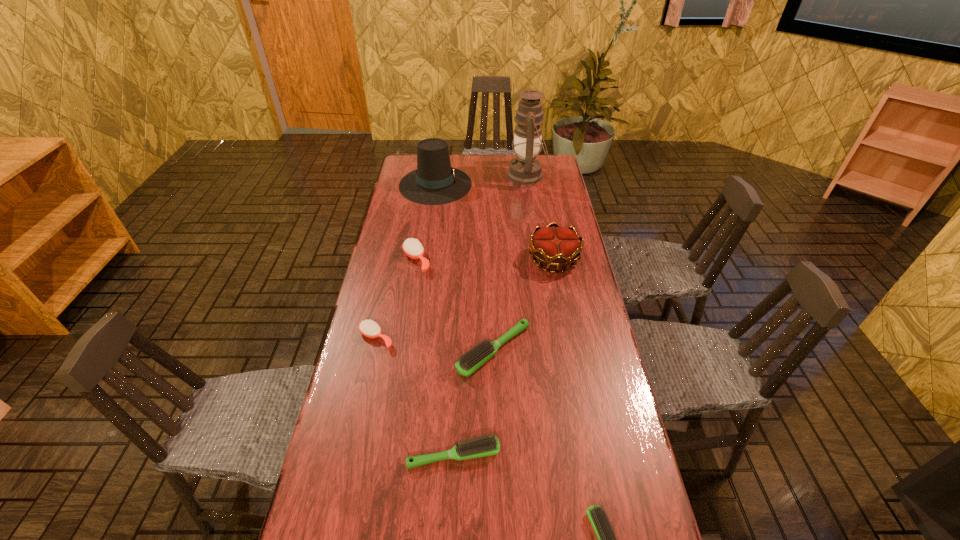
The width and height of the screenshot is (960, 540). I want to click on oil lamp, so click(525, 169).

Find the location of a particular element. The width and height of the screenshot is (960, 540). brown oil lamp is located at coordinates (525, 169).

You are a GUI agent. You are given a task and a screenshot of the screen. Output one action in this format:
    pyautogui.click(x=<x>, y=<y>)
    Task: Click on the hat
    This screenshot has height=540, width=960.
    Given the screenshot: What is the action you would take?
    pyautogui.click(x=434, y=182)

Where is `gray hat`? This screenshot has height=540, width=960. gray hat is located at coordinates (434, 182).

Where is `crown`? crown is located at coordinates (556, 246).

Find the location of `gold crown`. gold crown is located at coordinates (556, 246).

Identify the location of the bigger orange hairbrush. This screenshot has height=540, width=960. (412, 248).

Where is `the farthest hairbrush`? This screenshot has height=540, width=960. the farthest hairbrush is located at coordinates (412, 248).

Where is `the farthest light hairbrush`? The image size is (960, 540). the farthest light hairbrush is located at coordinates (473, 359).

This screenshot has width=960, height=540. Find the location of `the seventh farthest object`. the seventh farthest object is located at coordinates (485, 446).